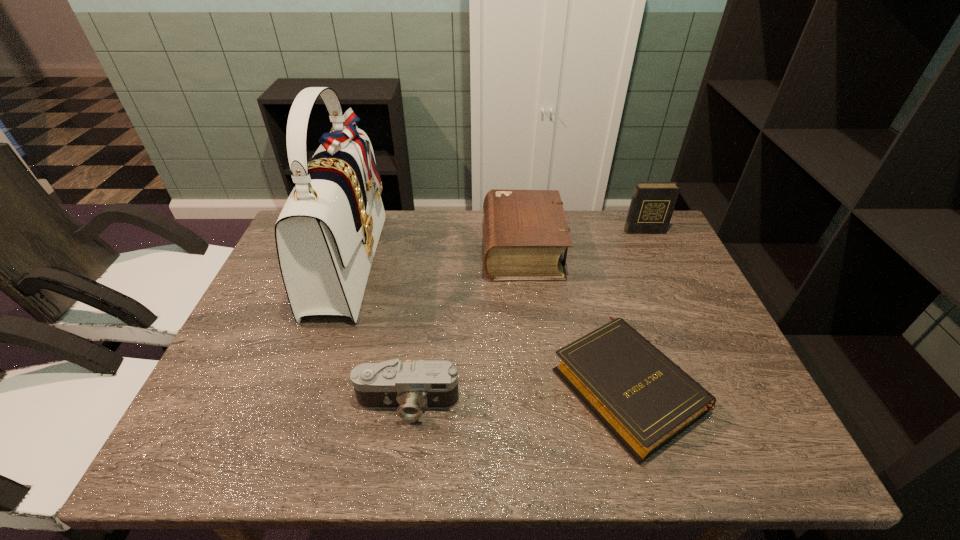
Identify the location of Bible present at the near edge. The height and width of the screenshot is (540, 960). (644, 400).

The height and width of the screenshot is (540, 960). I want to click on object that is at the left edge, so click(x=327, y=233).

Find the location of a particular element. The height and width of the screenshot is (540, 960). diary located in the right edge section of the desktop is located at coordinates (652, 204).

Identify the location of Bible that is at the right edge. (644, 400).

Locate an element on the screen. This screenshot has height=540, width=960. object that is at the far left corner is located at coordinates (327, 233).

Identify the location of object situated at the far right corner. (x=652, y=204).

Image resolution: width=960 pixels, height=540 pixels. Identify the location of object that is at the near right corner. (644, 400).

This screenshot has width=960, height=540. In the image, there is a desktop. Identify the location of vacant space at the far edge. (459, 231).

Identify the location of vacant space at the near edge of the desktop. (418, 444).

In the image, there is a desktop. Where is `vacant space at the right edge`? This screenshot has width=960, height=540. vacant space at the right edge is located at coordinates (673, 303).